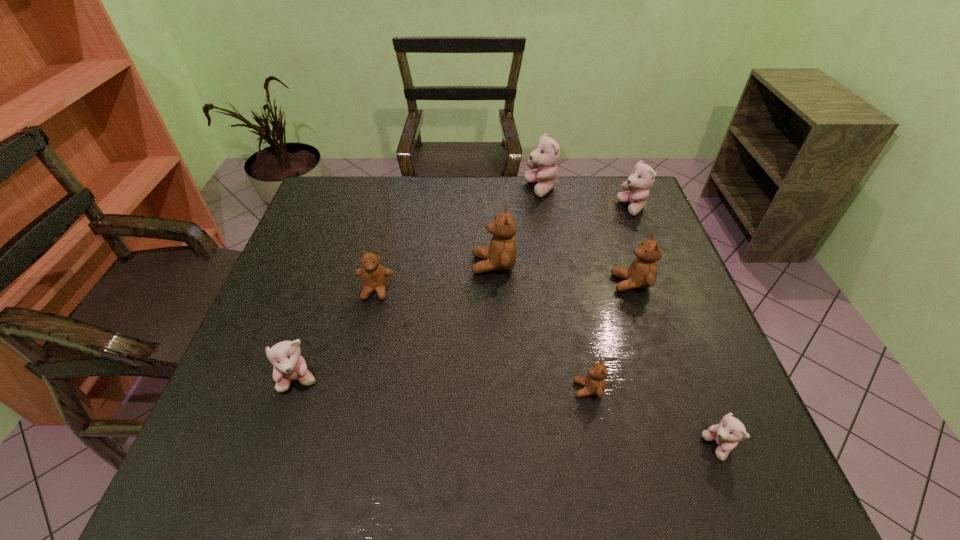
Locate an element on the screen. This screenshot has width=960, height=540. free space located 0.340m at the face of the second biggest pink teddy bear is located at coordinates (509, 208).

What are the coordinates of `vacant space located 0.140m at the face of the second biggest pink teddy bear` in the screenshot? It's located at (573, 208).

I want to click on free space located 0.230m on the face of the third smallest brown teddy bear, so click(524, 283).

Image resolution: width=960 pixels, height=540 pixels. What are the coordinates of `blank space located 0.390m on the face of the third smallest brown teddy bear` in the screenshot? It's located at (463, 283).

At what (x,y) coordinates should I click in order to perform the action: click on vacant space located 0.250m on the face of the third smallest brown teddy bear. Please return your answer as a coordinate pair (x, y). This screenshot has width=960, height=540. Looking at the image, I should click on (516, 283).

In order to click on blank space located 0.120m on the face of the leftmost brown teddy bear in this screenshot , I will do `click(364, 341)`.

Image resolution: width=960 pixels, height=540 pixels. What are the coordinates of `vacant space situated 0.060m at the face of the leftmost teddy bear` in the screenshot? It's located at (285, 423).

Locate an element on the screen. vacant space located 0.310m on the face of the third brown teddy bear from left to right is located at coordinates (426, 389).

The width and height of the screenshot is (960, 540). I want to click on vacant area located on the face of the third brown teddy bear from left to right, so pos(479,389).

Locate an element on the screen. The width and height of the screenshot is (960, 540). free space located on the face of the third brown teddy bear from left to right is located at coordinates (508, 389).